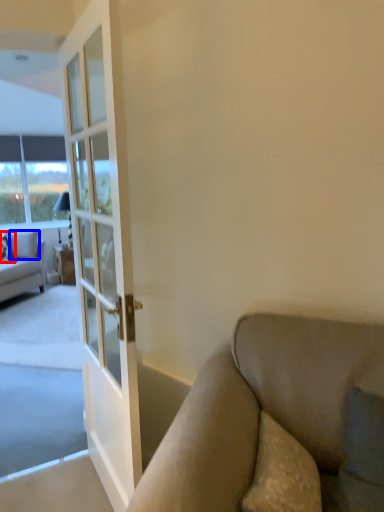
Question: Which point is further to the camera, pillow (highlighted by a red box) or pillow (highlighted by a blue box)?

Choices:
 (A) pillow
 (B) pillow

Answer: (B)